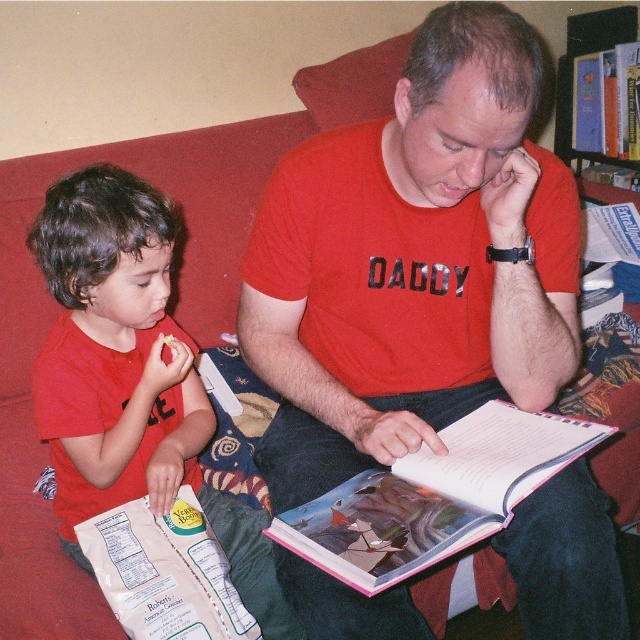
Which is above, hardcover book at upper right or wooden bookshelf at upper right?

wooden bookshelf at upper right

This screenshot has height=640, width=640. What are the coordinates of `hardcover book at upper right` in the screenshot? It's located at (602, 100).

Does point (496, 500) come behind point (573, 141)?

No, (496, 500) is in front of (573, 141).

Which is in front, point (481, 484) or point (621, 108)?

Point (481, 484) is more forward.

Is point (538, 444) positioned in front of point (618, 92)?

Yes, it is.

The width and height of the screenshot is (640, 640). In order to click on pink paper book at center in this screenshot , I will do `click(433, 497)`.

Can you confirm if matte red shirt at left is wider than pink paper book at center?

No, matte red shirt at left is not wider than pink paper book at center.

Does matte red shirt at left appear on the left side of pink paper book at center?

Yes, matte red shirt at left is to the left of pink paper book at center.

The height and width of the screenshot is (640, 640). Identify the location of matte red shirt at left. [131, 378].

Identify the location of matte red shirt at left. point(131,378).